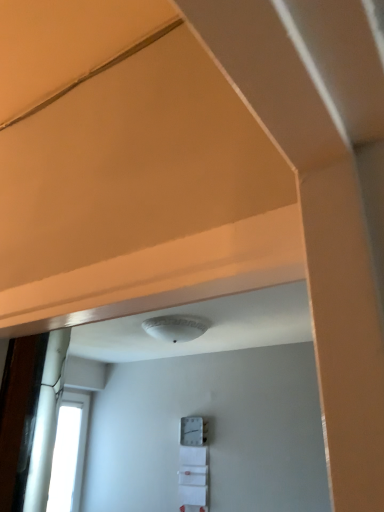
Measure the distance between white glass window at left and camera.

A distance of 13.15 feet exists between white glass window at left and camera.

Image resolution: width=384 pixels, height=512 pixels. I want to click on white glass window at left, so click(69, 452).

What do you see at coordinates (69, 452) in the screenshot? The width and height of the screenshot is (384, 512). I see `white glass window at left` at bounding box center [69, 452].

Find the location of a particular element. The image size is (384, 512). white glass window at left is located at coordinates (69, 452).